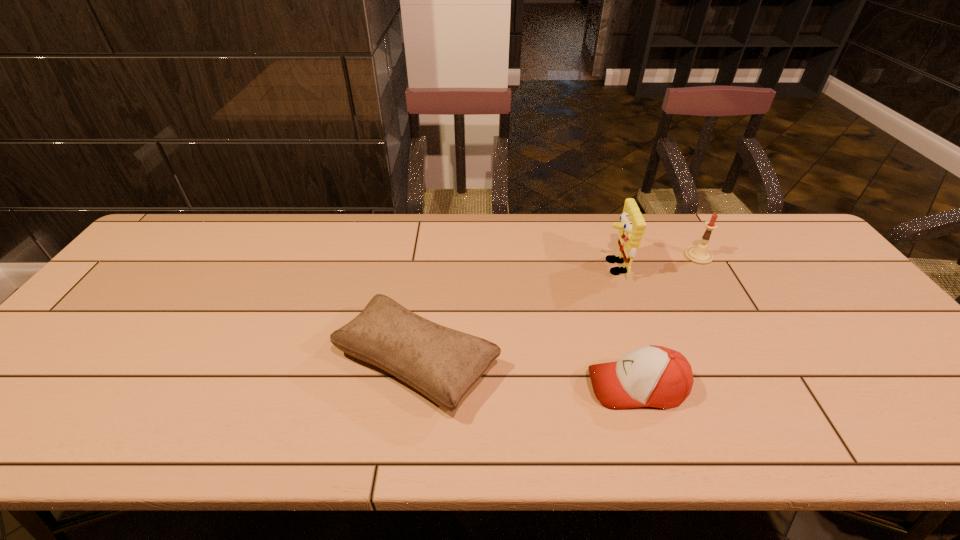
In order to click on vacant region located 0.170m on the front-facing side of the baseball cap in this screenshot , I will do `click(513, 387)`.

Find the location of a particular element. This screenshot has height=540, width=960. vacant position located on the front-facing side of the baseball cap is located at coordinates (460, 387).

Find the location of a particular element. The width and height of the screenshot is (960, 540). vacant point located on the front-facing side of the baseball cap is located at coordinates (473, 387).

Where is `sponge located in the far edge section of the desktop`? sponge located in the far edge section of the desktop is located at coordinates (631, 229).

The width and height of the screenshot is (960, 540). What are the coordinates of `candle located in the far edge section of the desktop` in the screenshot? It's located at (699, 254).

Locate an element on the screen. object that is at the near edge is located at coordinates (443, 364).

Where is `free space at the far edge of the desktop`? Image resolution: width=960 pixels, height=540 pixels. free space at the far edge of the desktop is located at coordinates (604, 234).

Where is `vacant area at the left edge of the desktop`? The height and width of the screenshot is (540, 960). vacant area at the left edge of the desktop is located at coordinates (73, 350).

Locate an element on the screen. free region at the right edge is located at coordinates (841, 340).

Image resolution: width=960 pixels, height=540 pixels. Find the location of `vacant space at the far right corner of the desktop`. vacant space at the far right corner of the desktop is located at coordinates (780, 213).